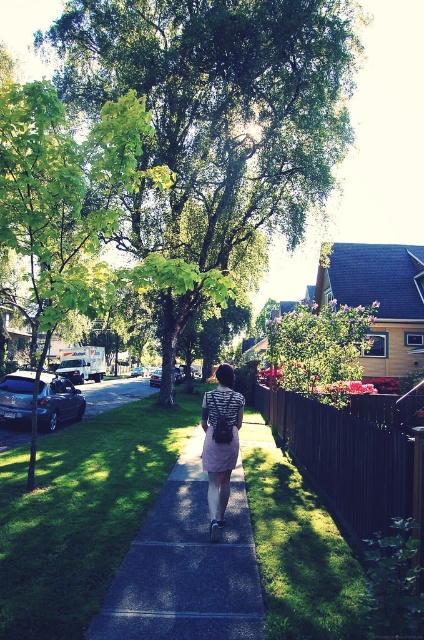
Which of these two, green leafy tree at center or gray concrete sidewalk at center, stands taller?

green leafy tree at center

Based on the photo, can you confirm if green leafy tree at center is thinner than gray concrete sidewalk at center?

No, green leafy tree at center is not thinner than gray concrete sidewalk at center.

Is point (63, 17) positioned before point (237, 563)?

No, (63, 17) is behind (237, 563).

Locate an element on the screen. green leafy tree at center is located at coordinates click(x=217, y=109).

The width and height of the screenshot is (424, 640). Describe the element at coordinates (64, 198) in the screenshot. I see `green leafy tree at left` at that location.

Identify the location of green leafy tree at left. Image resolution: width=424 pixels, height=640 pixels. (64, 198).

You are a GUI agent. You are given a task and a screenshot of the screen. Output one action in this format:
    pyautogui.click(x=<x>, y=<y>)
    Task: Click on the green leafy tree at left
    
    Given the screenshot: What is the action you would take?
    pyautogui.click(x=64, y=198)

This screenshot has height=640, width=424. What do you see at coordinates (217, 109) in the screenshot?
I see `green leafy tree at center` at bounding box center [217, 109].

Does green leafy tree at center appear on the right side of green leafy tree at left?

Correct, you'll find green leafy tree at center to the right of green leafy tree at left.

Find the location of a particular element. green leafy tree at center is located at coordinates (217, 109).

What are the coordinates of `green leafy tree at center` in the screenshot? It's located at (217, 109).